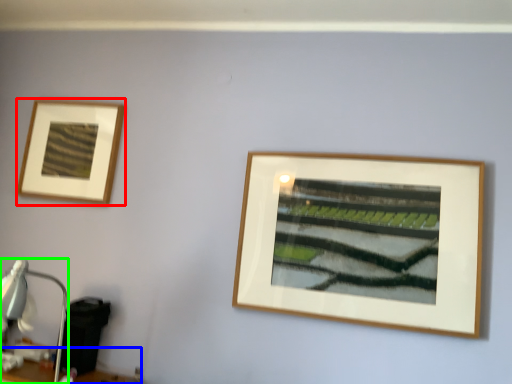
Question: Based on their relative distances, which object is farther from picture frame (highlighted by a red box)? Choose from table (highlighted by a blue box) and table lamp (highlighted by a green box).

Choices:
 (A) table
 (B) table lamp

Answer: (A)